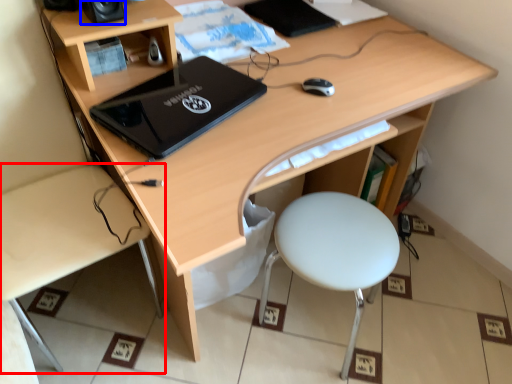
Question: Which object appears farthest to the camera in this image, desk (highlighted by a red box) or speaker (highlighted by a blue box)?

Choices:
 (A) desk
 (B) speaker

Answer: (B)